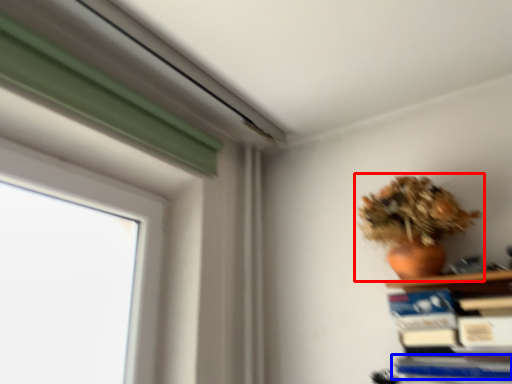
Question: Which object appears farthest to the camera in this image, houseplant (highlighted by a red box) or paperback book (highlighted by a blue box)?

Choices:
 (A) houseplant
 (B) paperback book

Answer: (A)